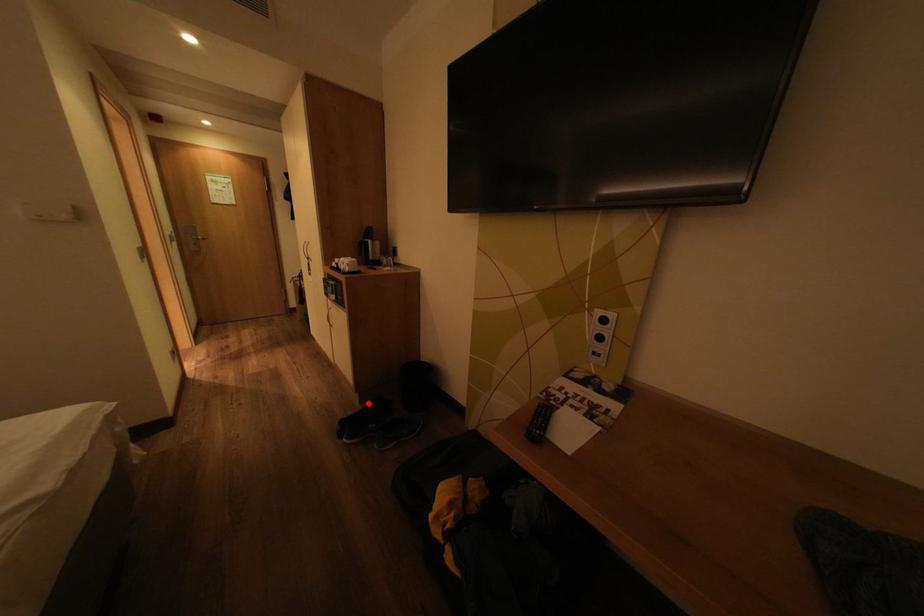
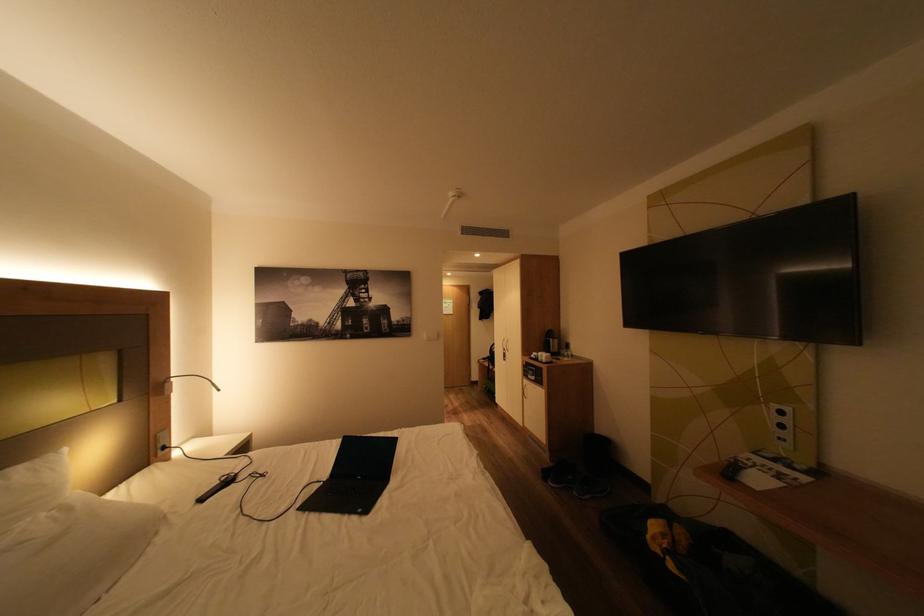
Locate, in the second image, the point that corresponds to the highlighted location in the first image.

(560, 461)